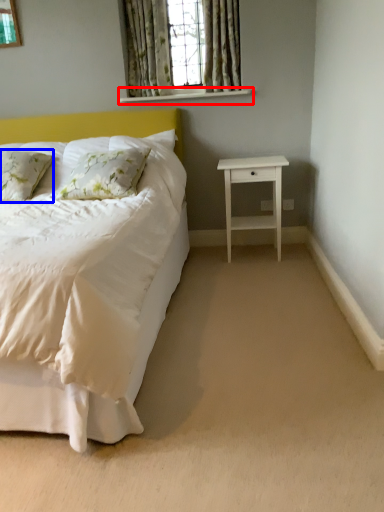
Question: Which of the following is the closest to the observer, window sill (highlighted by a red box) or pillow (highlighted by a blue box)?

Choices:
 (A) window sill
 (B) pillow

Answer: (B)